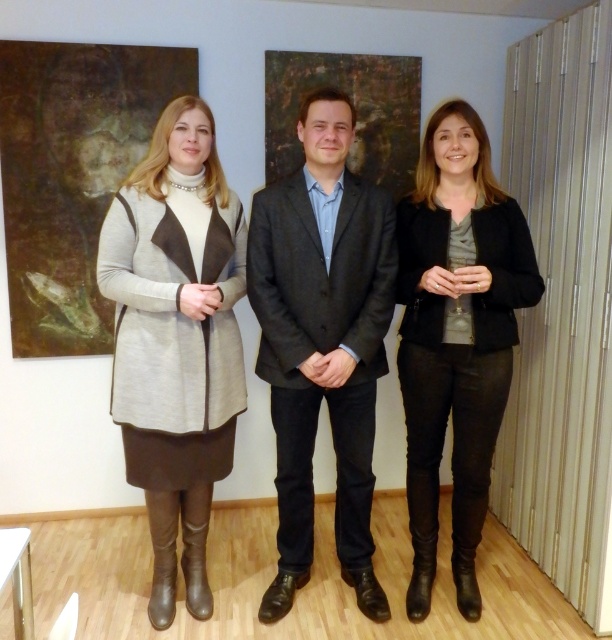
Can you confirm if matte gray coat at center is positioned below dark gray suit at center?

Yes, matte gray coat at center is below dark gray suit at center.

Is matte gray coat at center above dark gray suit at center?

No, matte gray coat at center is not above dark gray suit at center.

Who is more distant from viewer, (188, 221) or (318, 195)?

The point (318, 195) is more distant.

Identify the location of matte gray coat at center. (176, 339).

Who is positioned more to the right, dark gray suit at center or black leather pants at center?

From the viewer's perspective, black leather pants at center appears more on the right side.

Does dark gray suit at center have a lesser width compared to black leather pants at center?

No.

Image resolution: width=612 pixels, height=640 pixels. What do you see at coordinates (323, 340) in the screenshot?
I see `dark gray suit at center` at bounding box center [323, 340].

This screenshot has height=640, width=612. What are the coordinates of `dark gray suit at center` in the screenshot? It's located at (323, 340).

Which is more to the left, matte gray coat at center or black leather pants at center?

Positioned to the left is matte gray coat at center.

Can you confirm if matte gray coat at center is positioned to the right of black leather pants at center?

Incorrect, matte gray coat at center is not on the right side of black leather pants at center.

This screenshot has height=640, width=612. I want to click on matte gray coat at center, so click(176, 339).